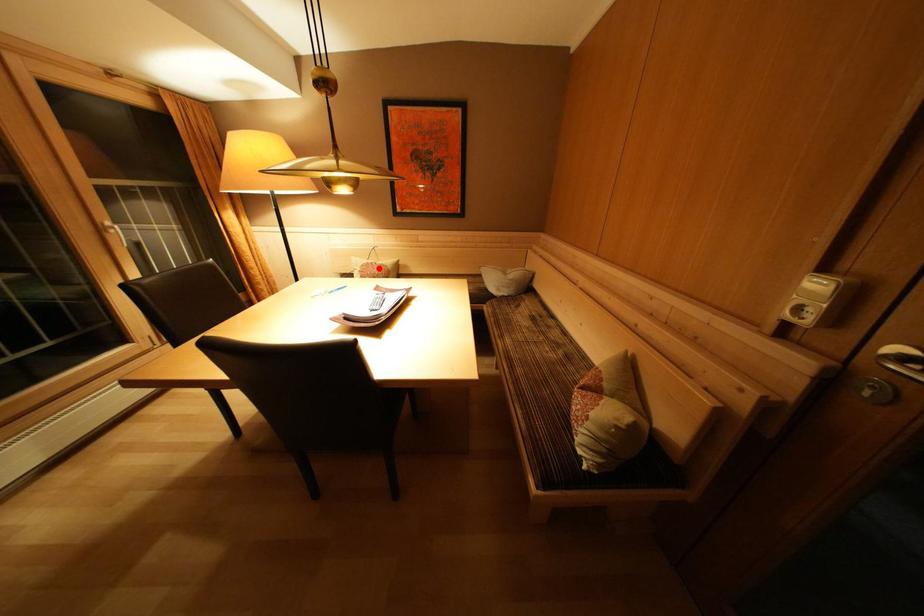
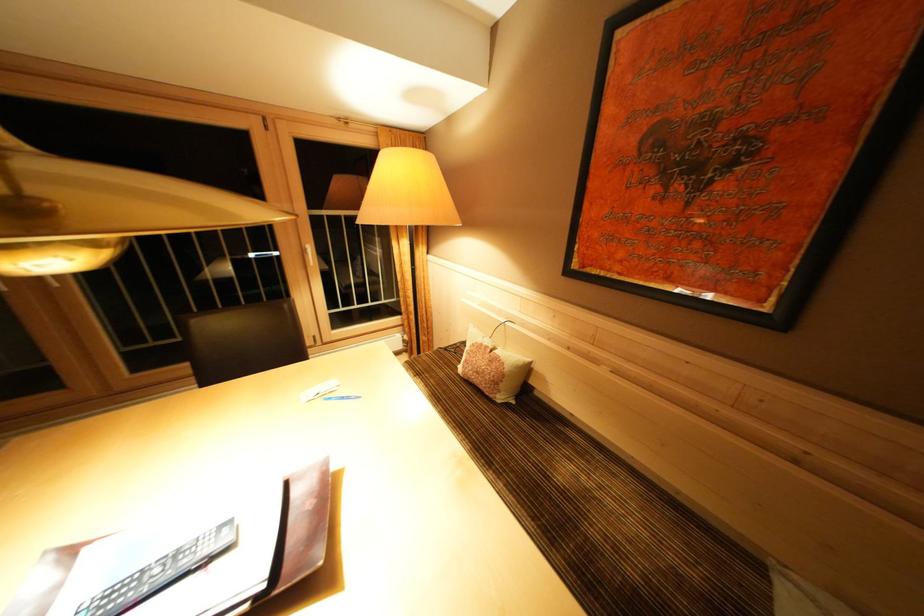
In the second image, find the point that corresponds to the highlighted location in the first image.

(493, 352)